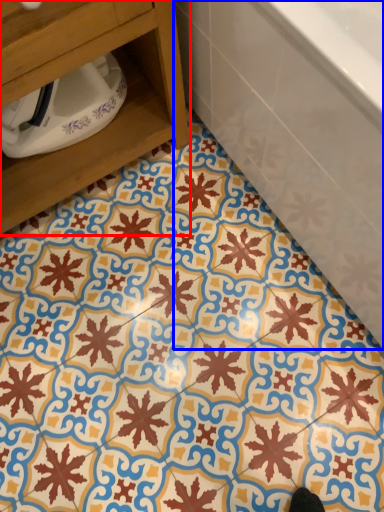
Question: Which object appears farthest to the camera in this image, furniture (highlighted by a red box) or bathtub (highlighted by a blue box)?

Choices:
 (A) furniture
 (B) bathtub

Answer: (A)